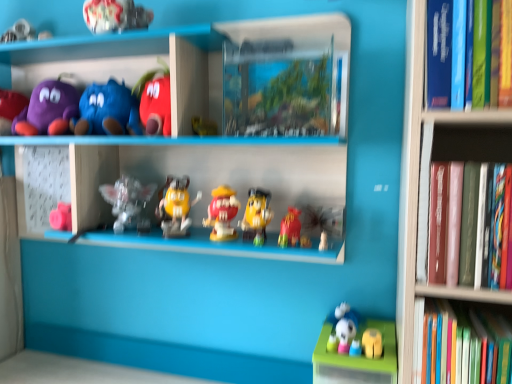
This screenshot has width=512, height=384. What do you see at coordinates (115, 15) in the screenshot?
I see `metallic silver toy at upper center, marked as the fifth toy in a left-to-right arrangement` at bounding box center [115, 15].

Image resolution: width=512 pixels, height=384 pixels. Find the location of `matte plush toy at upper left, the eighth toy when ordered from right to left`. matte plush toy at upper left, the eighth toy when ordered from right to left is located at coordinates (106, 111).

Find the location of a particular element. The width and height of the screenshot is (512, 384). purple plush toy at left, which is the 10th toy in right-to-left order is located at coordinates (10, 109).

Measure the distance between matte red bag at center, the 9th toy when ordered from left to right, and camera.

They are 3.45 feet apart.

The height and width of the screenshot is (384, 512). What are the coordinates of `metallic silver toy at upper center, marked as the fifth toy in a left-to-right arrangement` in the screenshot? It's located at (115, 15).

Who is smaller, green plastic toy at lower right or matte red bag at center, the 9th toy when ordered from left to right?

With smaller size is matte red bag at center, the 9th toy when ordered from left to right.

Which is in front, green plastic toy at lower right or matte red bag at center, which is the 2th toy in right-to-left order?

green plastic toy at lower right is in front.

From a real-world perspective, is green plastic toy at lower right located higher than matte red bag at center, which is the 2th toy in right-to-left order?

No.

Could you tell me if hardcover book at right, which ranks as the 2th book in bottom-to-top order, is turned towards metallic silver toy at upper center, marked as the fifth toy in a left-to-right arrangement?

No, hardcover book at right, which ranks as the 2th book in bottom-to-top order, is not facing towards metallic silver toy at upper center, marked as the fifth toy in a left-to-right arrangement.

Is hardcover book at right, arranged as the second book when viewed from the top, situated inside metallic silver toy at upper center, which is counted as the sixth toy, starting from the right, or outside?

hardcover book at right, arranged as the second book when viewed from the top, exists outside the volume of metallic silver toy at upper center, which is counted as the sixth toy, starting from the right.

From a real-world perspective, which object stands above the other?

In real-world perspective, metallic silver toy at upper center, marked as the fifth toy in a left-to-right arrangement, is above.

Does translucent plastic figurine at center, the 4th toy from the left, lie in front of matte red bag at center, which is the 2th toy in right-to-left order?

No, it is not.

Is translucent plastic figurine at center, marked as the 7th toy in a right-to-left arrangement, not within matte red bag at center, the 9th toy when ordered from left to right?

That's correct, translucent plastic figurine at center, marked as the 7th toy in a right-to-left arrangement, is outside of matte red bag at center, the 9th toy when ordered from left to right.

Is translucent plastic figurine at center, the 4th toy from the left, positioned with its back to matte red bag at center, which is the 2th toy in right-to-left order?

No.

Based on the photo, from a real-world perspective, which object stands above the other?

In real-world perspective, translucent plastic figurine at center, marked as the 7th toy in a right-to-left arrangement, is above.

Is matte plush toy at upper left, the eighth toy when ordered from right to left, with smooth plastic m&m figure at center, positioned as the seventh toy in left-to-right order?

There is a gap between matte plush toy at upper left, the eighth toy when ordered from right to left, and smooth plastic m&m figure at center, positioned as the seventh toy in left-to-right order.

Is point (96, 124) closer or farther from the camera than point (217, 208)?

Point (96, 124) is farther from the camera than point (217, 208).

From the image's perspective, does matte plush toy at upper left, the eighth toy when ordered from right to left, appear higher than smooth plastic m&m figure at center, positioned as the seventh toy in left-to-right order?

Yes, from the image's perspective, matte plush toy at upper left, the eighth toy when ordered from right to left, is on top of smooth plastic m&m figure at center, positioned as the seventh toy in left-to-right order.

Based on the photo, considering the positions of objects matte plush toy at upper left, the third toy from the left, and smooth plastic m&m figure at center, which is the fourth toy from right to left, in the image provided, who is in front, matte plush toy at upper left, the third toy from the left, or smooth plastic m&m figure at center, which is the fourth toy from right to left,?

smooth plastic m&m figure at center, which is the fourth toy from right to left, is more forward.

Considering the sizes of objects matte plush toy at upper left, the eighth toy when ordered from right to left, and translucent plastic figurine at center, the 4th toy from the left, in the image provided, who is shorter, matte plush toy at upper left, the eighth toy when ordered from right to left, or translucent plastic figurine at center, the 4th toy from the left,?

With less height is matte plush toy at upper left, the eighth toy when ordered from right to left.

In the scene shown: Considering the relative sizes of matte plush toy at upper left, the eighth toy when ordered from right to left, and translucent plastic figurine at center, marked as the 7th toy in a right-to-left arrangement, in the image provided, is matte plush toy at upper left, the eighth toy when ordered from right to left, thinner than translucent plastic figurine at center, marked as the 7th toy in a right-to-left arrangement,?

No.

From a real-world perspective, who is located lower, matte plush toy at upper left, the third toy from the left, or translucent plastic figurine at center, the 4th toy from the left?

translucent plastic figurine at center, the 4th toy from the left, from a real-world perspective.

The height and width of the screenshot is (384, 512). I want to click on the 1st toy positioned below the matte plush toy at upper left, the eighth toy when ordered from right to left (from the image's perspective), so click(x=128, y=203).

Who is smaller, metallic silver toy at upper center, marked as the fifth toy in a left-to-right arrangement, or hardcover book at right, arranged as the second book when viewed from the top?

Smaller between the two is metallic silver toy at upper center, marked as the fifth toy in a left-to-right arrangement.

From a real-world perspective, which is physically above, metallic silver toy at upper center, marked as the fifth toy in a left-to-right arrangement, or hardcover book at right, which ranks as the 2th book in bottom-to-top order?

From a 3D spatial view, metallic silver toy at upper center, marked as the fifth toy in a left-to-right arrangement, is above.

From a real-world perspective, starting from the metallic silver toy at upper center, which is counted as the sixth toy, starting from the right, which book is the 2nd one below it? Please provide its 2D coordinates.

[(472, 225)]

Considering the relative positions of metallic silver toy at upper center, which is counted as the sixth toy, starting from the right, and hardcover book at right, arranged as the second book when viewed from the top, in the image provided, is metallic silver toy at upper center, which is counted as the sixth toy, starting from the right, in front of hardcover book at right, arranged as the second book when viewed from the top,?

No, it is behind hardcover book at right, arranged as the second book when viewed from the top.

The height and width of the screenshot is (384, 512). Find the location of `the 2nd toy to the left when counting from the hardcover book at right, which appears as the 1th book when viewed from the top`. the 2nd toy to the left when counting from the hardcover book at right, which appears as the 1th book when viewed from the top is located at coordinates (290, 228).

Considering the positions of points (433, 68) and (281, 246), is point (433, 68) farther from camera compared to point (281, 246)?

No, it is in front of (281, 246).

Between hardcover book at right, marked as the third book in a bottom-to-top arrangement, and matte red bag at center, which is the 2th toy in right-to-left order, which one has larger width?

With larger width is hardcover book at right, marked as the third book in a bottom-to-top arrangement.

At what (x,y) coordinates should I click in order to perform the action: click on the 1st toy counting from the left side of the green plastic toy at lower right. Please return your answer as a coordinate pair (x, y). Looking at the image, I should click on (290, 228).

Locate an element on the screen. the 4th toy above the hardcover book at right, arranged as the second book when viewed from the top (from the image's perspective) is located at coordinates (115, 15).

Estimate the real-world distances between objects in this image. Which object is closer to matte yellow figure at center, acting as the 3th toy starting from the right, purple plush toy at upper left, the 9th toy positioned from the right, or green plastic toy at lower right?

green plastic toy at lower right is positioned closer to the anchor matte yellow figure at center, acting as the 3th toy starting from the right.

From the image, which object appears to be farther from matte yellow figure at center, acting as the 3th toy starting from the right, purple plush toy at left, which is the 10th toy in right-to-left order, or hardcover book at right, acting as the 1th book starting from the bottom?

purple plush toy at left, which is the 10th toy in right-to-left order, is further to matte yellow figure at center, acting as the 3th toy starting from the right.

Which object lies nearer to the anchor point matte yellow figure at center, the eighth toy viewed from the left, matte plush toy at upper left, the eighth toy when ordered from right to left, or hardcover book at right, arranged as the second book when viewed from the top?

The object closer to matte yellow figure at center, the eighth toy viewed from the left, is matte plush toy at upper left, the eighth toy when ordered from right to left.

Which object lies nearer to the anchor point matte plush toy at upper left, the eighth toy when ordered from right to left, purple plush toy at left, arranged as the first toy when viewed from the left, or metallic silver toy at upper center, which is counted as the sixth toy, starting from the right?

metallic silver toy at upper center, which is counted as the sixth toy, starting from the right.

Estimate the real-world distances between objects in this image. Which object is further from hardcover book at right, arranged as the second book when viewed from the top, yellow matte m&m figure at center, placed as the 6th toy when sorted from left to right, or green plastic toy at lower right?

Among the two, yellow matte m&m figure at center, placed as the 6th toy when sorted from left to right, is located further to hardcover book at right, arranged as the second book when viewed from the top.

Estimate the real-world distances between objects in this image. Which object is closer to hardcover book at right, the 3th book positioned from the top, yellow matte m&m figure at center, which is the fifth toy in right-to-left order, or metallic silver toy at upper center, which is counted as the sixth toy, starting from the right?

yellow matte m&m figure at center, which is the fifth toy in right-to-left order, lies closer to hardcover book at right, the 3th book positioned from the top, than the other object.

Based on their spatial positions, is matte yellow figure at center, acting as the 3th toy starting from the right, or hardcover book at right, marked as the third book in a bottom-to-top arrangement, closer to purple plush toy at upper left, the 9th toy positioned from the right?

matte yellow figure at center, acting as the 3th toy starting from the right, is positioned closer to the anchor purple plush toy at upper left, the 9th toy positioned from the right.

Based on their spatial positions, is smooth plastic m&m figure at center, which is the fourth toy from right to left, or metallic silver toy at upper center, which is counted as the sixth toy, starting from the right, further from purple plush toy at upper left, the second toy viewed from the left?

Based on the image, smooth plastic m&m figure at center, which is the fourth toy from right to left, appears to be further to purple plush toy at upper left, the second toy viewed from the left.

The image size is (512, 384). I want to click on toy between smooth plastic m&m figure at center, which is the fourth toy from right to left, and matte red bag at center, the 9th toy when ordered from left to right, in the horizontal direction, so click(x=256, y=216).

Where is `toy between hardcover book at right, which ranks as the 2th book in bottom-to-top order, and matte red bag at center, the 9th toy when ordered from left to right, from front to back`? toy between hardcover book at right, which ranks as the 2th book in bottom-to-top order, and matte red bag at center, the 9th toy when ordered from left to right, from front to back is located at coordinates (372, 343).

I want to click on book between hardcover book at right, which appears as the 1th book when viewed from the top, and hardcover book at right, the 3th book positioned from the top, vertically, so click(472, 225).

The width and height of the screenshot is (512, 384). In order to click on toy located between purple plush toy at left, which is the 10th toy in right-to-left order, and matte plush toy at upper left, the eighth toy when ordered from right to left, in the left-right direction in this screenshot , I will do `click(48, 109)`.